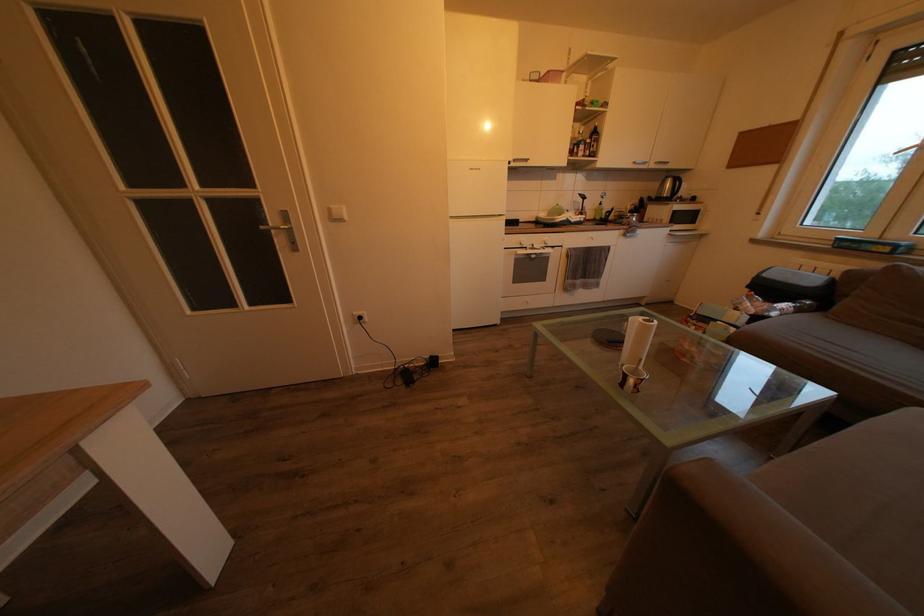
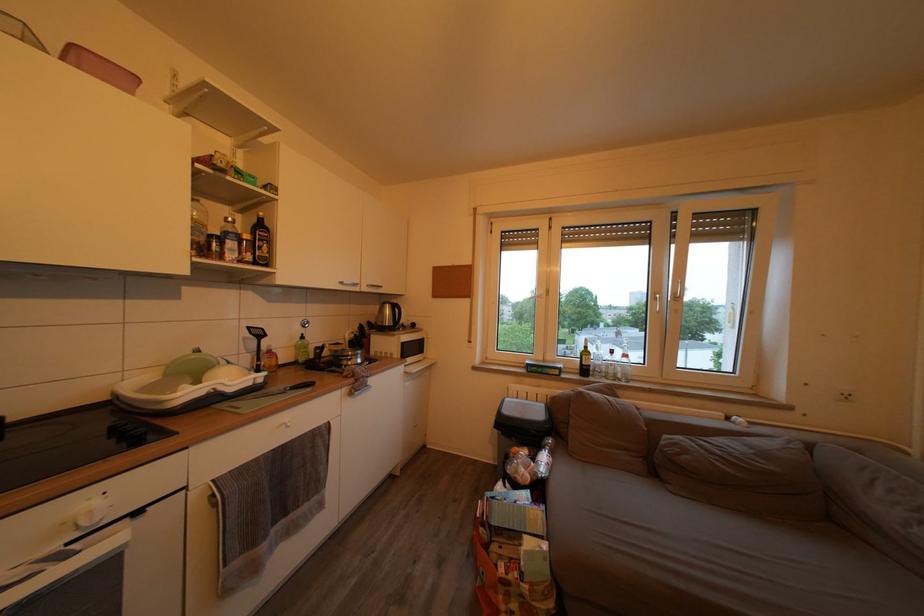
The point at (x=580, y=227) is marked in the first image. Where is the corresponding point in the second image?

(238, 397)